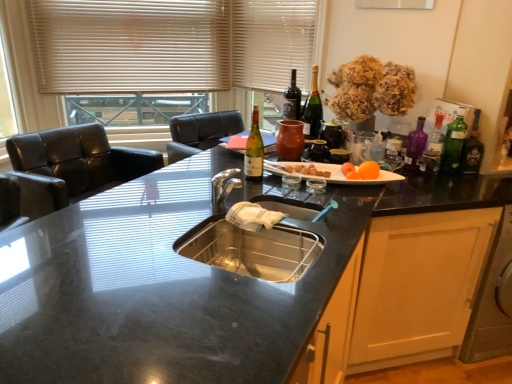
Identify the location of vacant area on top of black granite countertop at center (from a real-world perspective). The height and width of the screenshot is (384, 512). (152, 276).